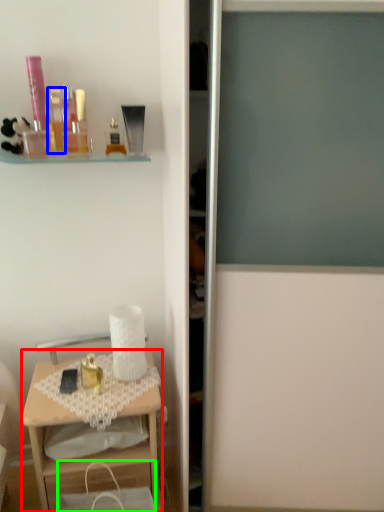
Question: Based on their relative distances, which object is nearer to desk (highlighted by a red box)? Choose from toiletry (highlighted by a blue box) and handbag (highlighted by a green box).

Choices:
 (A) toiletry
 (B) handbag

Answer: (B)